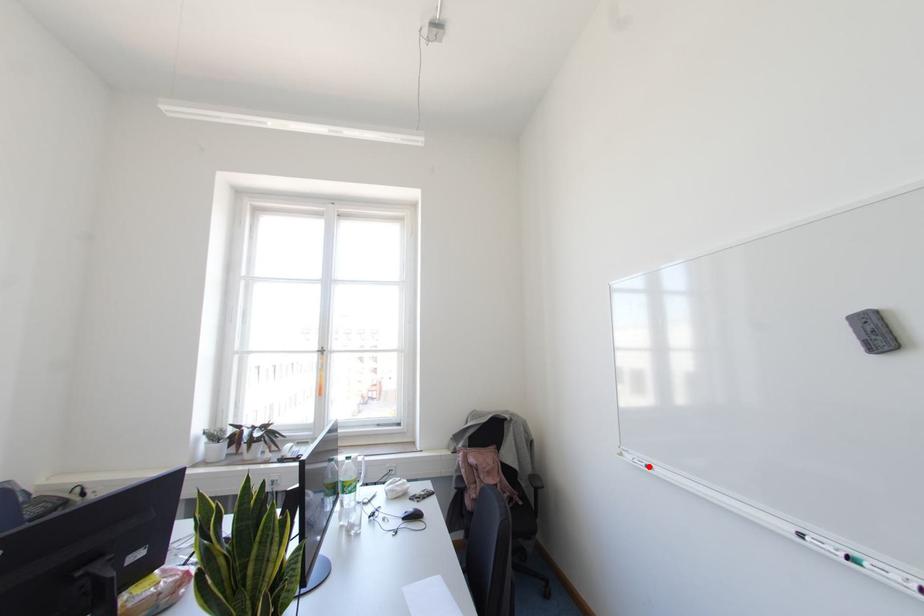
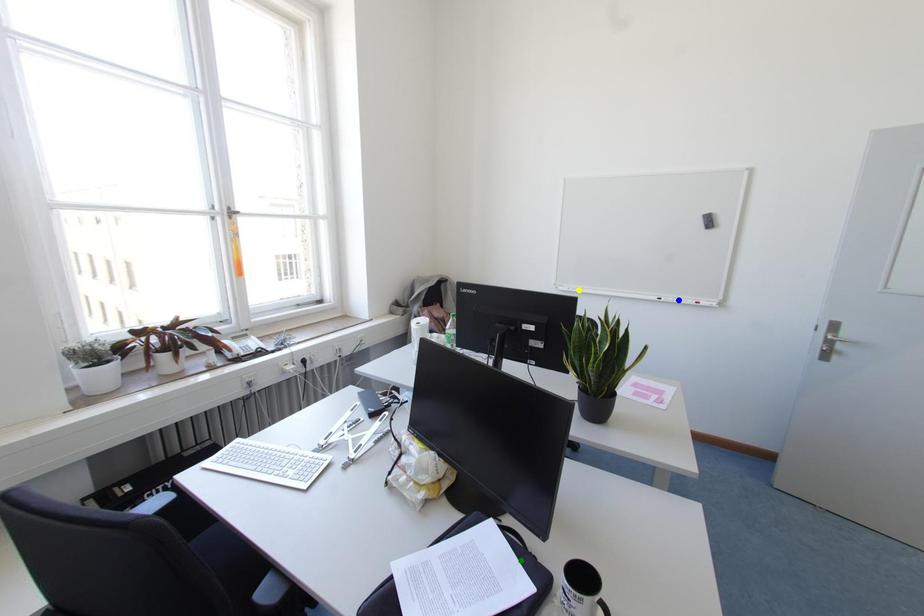
Question: I am providing you with two images of the same scene from different viewpoints. A red point is marked on the first image. You are given multiple points on the second image. Can you choose the point in image 2 that corresponds to the point in image 1?

Choices:
 (A) blue point
 (B) yellow point
 (C) green point

Answer: (B)